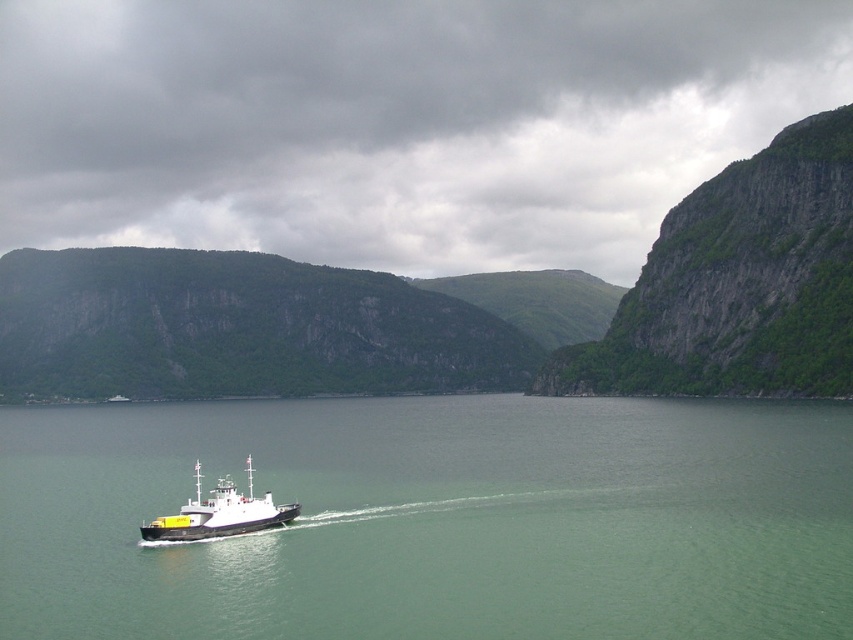
Does green rocky cliff at center have a lesser width compared to green rocky cliff at upper right?

Incorrect, green rocky cliff at center's width is not less than green rocky cliff at upper right's.

Which is below, green rocky cliff at center or green rocky cliff at upper right?

green rocky cliff at upper right

Between point (795, 237) and point (614, 362), which one is positioned behind?

Positioned behind is point (614, 362).

Image resolution: width=853 pixels, height=640 pixels. Find the location of `green rocky cliff at center`. green rocky cliff at center is located at coordinates (463, 307).

Between green water at center and black matte boat at center, which one is positioned lower?

green water at center

Can you confirm if green water at center is bigger than black matte boat at center?

Indeed, green water at center has a larger size compared to black matte boat at center.

This screenshot has width=853, height=640. Find the location of `green water at center`. green water at center is located at coordinates (434, 520).

Does green water at center appear on the left side of green rocky cliff at center?

In fact, green water at center is to the right of green rocky cliff at center.

Describe the element at coordinates (434, 520) in the screenshot. The height and width of the screenshot is (640, 853). I see `green water at center` at that location.

What are the coordinates of `green water at center` in the screenshot? It's located at (434, 520).